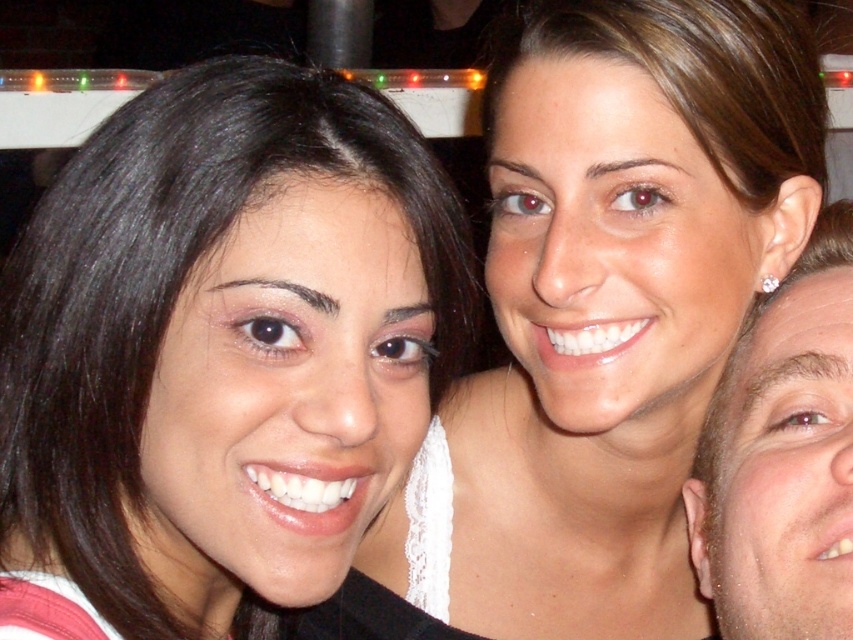
Based on the photo, you are a photographer adjusting the focus of your camera. You need to ensure that the matte black hair at left is in the center of the frame. What adjustment should you make to the camera focus point?

The matte black hair at left is located at point (219, 353), so you should adjust the focus point to this coordinate to center it.

You are a photographer adjusting your camera focus. You notice the matte black hair at left and the matte white top at center in your viewfinder. Which object should you focus on first if you want to ensure the closest subject is sharp?

The matte black hair at left is closer to the viewer than the matte white top at center, so you should focus on the matte black hair at left first to ensure the closest subject is sharp.